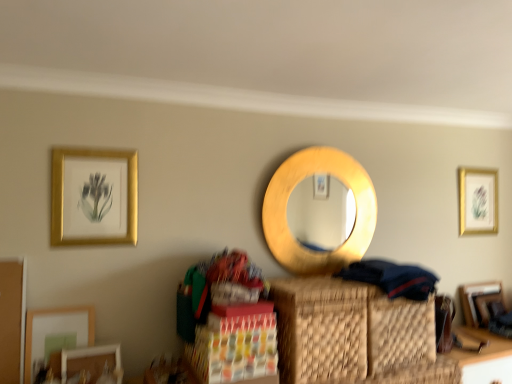
What do you see at coordinates (56, 333) in the screenshot? I see `matte gold picture frame at lower left, the second picture frame positioned from the front` at bounding box center [56, 333].

Measure the distance between point [379,276] and camera.

Point [379,276] and camera are 1.82 meters apart.

Find the location of `matte gold picture frame at lower left, which is the first picture frame in left-to-right order`. matte gold picture frame at lower left, which is the first picture frame in left-to-right order is located at coordinates (56, 333).

Is gold wooden mirror at center aimed at matte white picture frame at lower left, arranged as the fifth picture frame when viewed from the back?

No, gold wooden mirror at center is not turned towards matte white picture frame at lower left, arranged as the fifth picture frame when viewed from the back.

From a real-world perspective, which is physically above, gold wooden mirror at center or matte white picture frame at lower left, the 3th picture frame when ordered from right to left?

In real-world perspective, gold wooden mirror at center is above.

Does point (358, 219) come farther from viewer compared to point (120, 357)?

Yes, it is.

Is gold wooden mirror at center taller or shorter than matte white picture frame at lower left, arranged as the fifth picture frame when viewed from the back?

Considering their sizes, gold wooden mirror at center has more height than matte white picture frame at lower left, arranged as the fifth picture frame when viewed from the back.

Which picture frame is the 2nd one when counting from the right side of the matte gold picture frame at lower left, the fourth picture frame when ordered from back to front? Please provide its 2D coordinates.

[(92, 362)]

Who is smaller, matte gold picture frame at lower left, the 5th picture frame positioned from the right, or matte white picture frame at lower left, arranged as the fifth picture frame when viewed from the back?

Smaller between the two is matte white picture frame at lower left, arranged as the fifth picture frame when viewed from the back.

From the image's perspective, which object appears higher, matte gold picture frame at lower left, which is the first picture frame in left-to-right order, or matte white picture frame at lower left, arranged as the first picture frame when viewed from the front?

matte gold picture frame at lower left, which is the first picture frame in left-to-right order.

Looking at this image, could you tell me if wooden table at lower right is facing gold/golden frame at upper left, the third picture frame from the front?

No, wooden table at lower right is not turned towards gold/golden frame at upper left, the third picture frame from the front.

You are a GUI agent. You are given a task and a screenshot of the screen. Output one action in this format:
    pyautogui.click(x=<x>, y=<y>)
    Task: Click on the table located below the gold/golden frame at upper left, which is counted as the 2th picture frame, starting from the left (from the image's perspective)
    
    Given the screenshot: What is the action you would take?
    pyautogui.click(x=483, y=356)

From the image's perspective, is wooden table at lower right on top of gold/golden frame at upper left, the 3th picture frame when ordered from back to front?

No, from the image's perspective, wooden table at lower right is not on top of gold/golden frame at upper left, the 3th picture frame when ordered from back to front.

Considering the relative positions of wooden table at lower right and gold/golden frame at upper left, the 3th picture frame when ordered from back to front, in the image provided, is wooden table at lower right in front of gold/golden frame at upper left, the 3th picture frame when ordered from back to front,?

No, it is not.

Between point (68, 331) and point (471, 344), which one is positioned in front?

Point (68, 331)

Does matte gold picture frame at lower left, the second picture frame positioned from the front, have a smaller size compared to wooden table at lower right?

Correct, matte gold picture frame at lower left, the second picture frame positioned from the front, occupies less space than wooden table at lower right.

Is matte gold picture frame at lower left, the second picture frame positioned from the front, aimed at wooden table at lower right?

No, matte gold picture frame at lower left, the second picture frame positioned from the front, is not turned towards wooden table at lower right.

Does matte gold picture frame at lower left, which is the first picture frame in left-to-right order, come behind wooden table at lower right?

That is False.

From the image's perspective, relative to dark blue fabric at lower right, is matte white picture frame at lower left, the 3th picture frame when ordered from right to left, above or below?

Clearly, from the image's perspective, matte white picture frame at lower left, the 3th picture frame when ordered from right to left, is below dark blue fabric at lower right.

Considering the positions of objects matte white picture frame at lower left, the 3th picture frame when ordered from right to left, and dark blue fabric at lower right in the image provided, who is in front, matte white picture frame at lower left, the 3th picture frame when ordered from right to left, or dark blue fabric at lower right?

matte white picture frame at lower left, the 3th picture frame when ordered from right to left.

Does matte white picture frame at lower left, the 3th picture frame positioned from the left, have a larger size compared to dark blue fabric at lower right?

No, matte white picture frame at lower left, the 3th picture frame positioned from the left, is not bigger than dark blue fabric at lower right.

Considering the relative positions of matte white picture frame at lower left, the 3th picture frame when ordered from right to left, and dark blue fabric at lower right in the image provided, is matte white picture frame at lower left, the 3th picture frame when ordered from right to left, to the left of dark blue fabric at lower right from the viewer's perspective?

Correct, you'll find matte white picture frame at lower left, the 3th picture frame when ordered from right to left, to the left of dark blue fabric at lower right.

Which of these two, gold wooden mirror at center or woven brown basket at center, is smaller?

Smaller between the two is gold wooden mirror at center.

Considering the relative sizes of gold wooden mirror at center and woven brown basket at center in the image provided, is gold wooden mirror at center wider than woven brown basket at center?

In fact, gold wooden mirror at center might be narrower than woven brown basket at center.

Is gold wooden mirror at center to the right of woven brown basket at center from the viewer's perspective?

In fact, gold wooden mirror at center is to the left of woven brown basket at center.

Find the location of `mirror above the woven brown basket at center (from the image's perspective)`. mirror above the woven brown basket at center (from the image's perspective) is located at coordinates (288, 200).

Is gold/golden frame at upper right, arranged as the 1th picture frame when viewed from the back, thinner than matte white picture frame at lower left, the 3th picture frame when ordered from right to left?

Yes, gold/golden frame at upper right, arranged as the 1th picture frame when viewed from the back, is thinner than matte white picture frame at lower left, the 3th picture frame when ordered from right to left.

Is gold/golden frame at upper right, which is counted as the first picture frame, starting from the right, at the right side of matte white picture frame at lower left, arranged as the fifth picture frame when viewed from the back?

Yes, gold/golden frame at upper right, which is counted as the first picture frame, starting from the right, is to the right of matte white picture frame at lower left, arranged as the fifth picture frame when viewed from the back.

Are gold/golden frame at upper right, marked as the 5th picture frame in a left-to-right arrangement, and matte white picture frame at lower left, the 3th picture frame positioned from the left, beside each other?

gold/golden frame at upper right, marked as the 5th picture frame in a left-to-right arrangement, and matte white picture frame at lower left, the 3th picture frame positioned from the left, are clearly separated.

Find the location of a particular element. The width and height of the screenshot is (512, 384). mirror located on the right of matte white picture frame at lower left, the 3th picture frame when ordered from right to left is located at coordinates (288, 200).

Find the location of a particular element. This screenshot has height=384, width=512. the 2nd picture frame above when counting from the matte white picture frame at lower left, arranged as the fifth picture frame when viewed from the back (from the image's perspective) is located at coordinates (56, 333).

Looking at the image, which one is located further to matte gold picture frame at lower left, the 5th picture frame positioned from the right, dark blue fabric at lower right or gold wooden mirror at center?

dark blue fabric at lower right lies further to matte gold picture frame at lower left, the 5th picture frame positioned from the right, than the other object.

Looking at this image, looking at the image, which one is located further to wooden picture frame at lower right, which ranks as the second picture frame in right-to-left order, dark blue fabric at lower right or wooden table at lower right?

dark blue fabric at lower right lies further to wooden picture frame at lower right, which ranks as the second picture frame in right-to-left order, than the other object.

From the picture: Looking at the image, which one is located closer to gold/golden frame at upper right, marked as the 5th picture frame in a left-to-right arrangement, wooden table at lower right or matte white picture frame at lower left, arranged as the fifth picture frame when viewed from the back?

The object closer to gold/golden frame at upper right, marked as the 5th picture frame in a left-to-right arrangement, is wooden table at lower right.

Based on their spatial positions, is gold/golden frame at upper right, which is counted as the first picture frame, starting from the right, or matte gold picture frame at lower left, which is the first picture frame in left-to-right order, closer to gold/golden frame at upper left, the 4th picture frame in the right-to-left sequence?

matte gold picture frame at lower left, which is the first picture frame in left-to-right order, lies closer to gold/golden frame at upper left, the 4th picture frame in the right-to-left sequence, than the other object.

Estimate the real-world distances between objects in this image. Which object is further from woven brown basket at center, matte white picture frame at lower left, the 3th picture frame positioned from the left, or gold/golden frame at upper right, which is counted as the first picture frame, starting from the right?

gold/golden frame at upper right, which is counted as the first picture frame, starting from the right.

Which object lies nearer to the anchor point gold/golden frame at upper right, which ranks as the 5th picture frame in front-to-back order, gold/golden frame at upper left, the third picture frame from the front, or matte gold picture frame at lower left, the fourth picture frame when ordered from back to front?

gold/golden frame at upper left, the third picture frame from the front.

Which object lies further to the anchor point dark blue fabric at lower right, gold wooden mirror at center or wooden picture frame at lower right, placed as the second picture frame when sorted from back to front?

wooden picture frame at lower right, placed as the second picture frame when sorted from back to front, is further to dark blue fabric at lower right.

Based on their spatial positions, is woven brown basket at center or dark blue fabric at lower right further from matte gold picture frame at lower left, the second picture frame positioned from the front?

Based on the image, dark blue fabric at lower right appears to be further to matte gold picture frame at lower left, the second picture frame positioned from the front.

Identify the location of table between gold wooden mirror at center and gold/golden frame at upper right, arranged as the 1th picture frame when viewed from the back, from left to right. (483, 356).

At what (x,y) coordinates should I click in order to perform the action: click on clothing between matte white picture frame at lower left, arranged as the fifth picture frame when viewed from the back, and gold/golden frame at upper right, arranged as the 1th picture frame when viewed from the back, from left to right. Please return your answer as a coordinate pair (x, y). This screenshot has height=384, width=512. Looking at the image, I should click on (392, 278).

Where is `table between gold/golden frame at upper left, which is counted as the 2th picture frame, starting from the left, and gold/golden frame at upper right, arranged as the 1th picture frame when viewed from the back, from left to right`? table between gold/golden frame at upper left, which is counted as the 2th picture frame, starting from the left, and gold/golden frame at upper right, arranged as the 1th picture frame when viewed from the back, from left to right is located at coordinates (483, 356).

This screenshot has height=384, width=512. Find the location of `basket positioned between dark blue fabric at lower right and gold/golden frame at upper right, which ranks as the 5th picture frame in front-to-back order, from near to far`. basket positioned between dark blue fabric at lower right and gold/golden frame at upper right, which ranks as the 5th picture frame in front-to-back order, from near to far is located at coordinates pos(355,335).